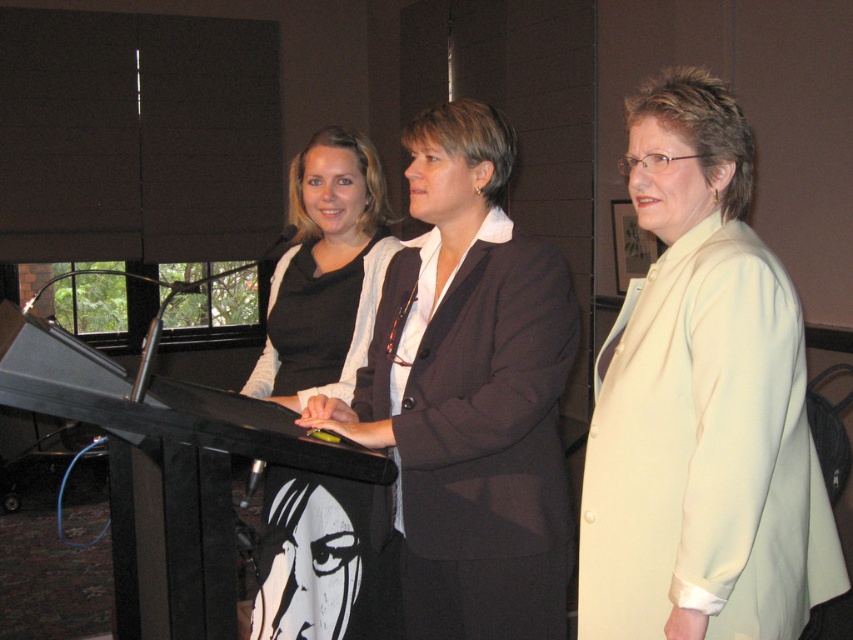
From the picture: You are standing in the conference room and want to place a name tag on the white satin blazer at center located at point (701, 404). The name tag is 10 cm wide. What is the minimum width of the blazer required to fit the name tag without overlapping?

The white satin blazer at center has a width of 10 cm, so the name tag can fit perfectly without overlapping.

You are an event organizer setting up a photo shoot in the conference room. You need to position a light source above the white satin blazer at center and the matte black dress at center. According to the scene description, which object should the light be placed above to ensure it casts a shadow on the other?

The white satin blazer at center is below the matte black dress at center, so placing the light source above the matte black dress at center will cast its shadow downward onto the white satin blazer at center.

You are standing in the conference room and want to place a small plant on the podium. The podium has two spots marked at coordinates point [737,588] and point [434,237]. Which spot is closer to you where you can place the plant?

Point [737,588] is closer to the viewer than point [434,237], so you should place the plant at point [737,588] as it is nearer to your position.